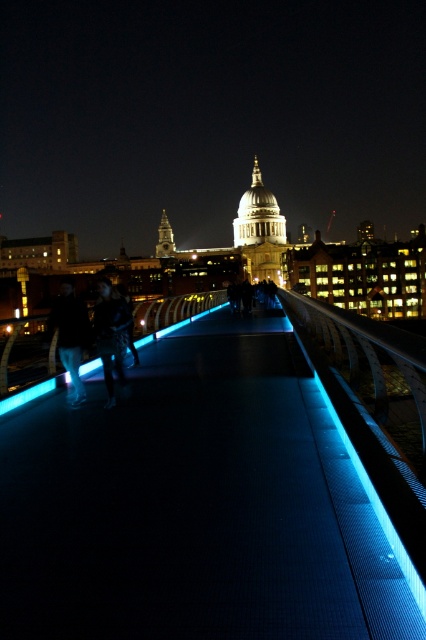
You are standing on the modern pedestrian bridge and want to take a photo of both the dark blue jeans at left and the dark blue leather jacket at center. Which object should you focus on first to ensure both are in the frame?

You should focus on the dark blue jeans at left first because it is closer to you than the dark blue leather jacket at center, ensuring both are in the frame.

You are standing on the modern pedestrian bridge and want to know how far the point at coordinates [60,349] is from you. Can you determine the distance?

The distance of point [60,349] from viewer is 82.43 meters.